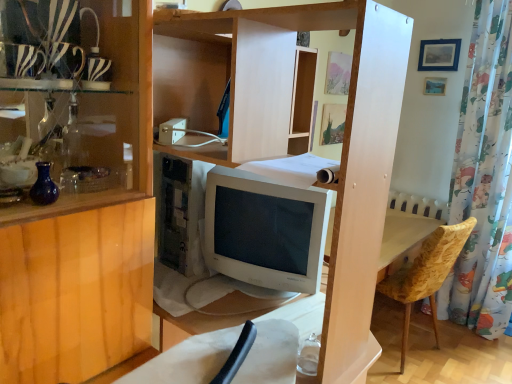
Question: Is zebra-patterned glass at upper left closer to the viewer compared to velvet yellow chair at lower right?

Choices:
 (A) no
 (B) yes

Answer: (B)

Question: Considering the relative sizes of zebra-patterned glass at upper left and velvet yellow chair at lower right in the image provided, is zebra-patterned glass at upper left taller than velvet yellow chair at lower right?

Choices:
 (A) yes
 (B) no

Answer: (B)

Question: Does zebra-patterned glass at upper left appear on the right side of velvet yellow chair at lower right?

Choices:
 (A) yes
 (B) no

Answer: (B)

Question: From the image's perspective, is zebra-patterned glass at upper left on top of velvet yellow chair at lower right?

Choices:
 (A) no
 (B) yes

Answer: (B)

Question: From a real-world perspective, is zebra-patterned glass at upper left physically below velvet yellow chair at lower right?

Choices:
 (A) no
 (B) yes

Answer: (A)

Question: Does zebra-patterned glass at upper left appear on the left side of velvet yellow chair at lower right?

Choices:
 (A) yes
 (B) no

Answer: (A)

Question: Can you confirm if zebra-patterned glass at upper left is wider than blue glass vase at left?

Choices:
 (A) no
 (B) yes

Answer: (B)

Question: Can you confirm if zebra-patterned glass at upper left is taller than blue glass vase at left?

Choices:
 (A) no
 (B) yes

Answer: (B)

Question: Considering the relative positions of zebra-patterned glass at upper left and blue glass vase at left in the image provided, is zebra-patterned glass at upper left behind blue glass vase at left?

Choices:
 (A) no
 (B) yes

Answer: (B)

Question: Considering the relative positions of zebra-patterned glass at upper left and blue glass vase at left in the image provided, is zebra-patterned glass at upper left to the right of blue glass vase at left from the viewer's perspective?

Choices:
 (A) no
 (B) yes

Answer: (A)

Question: From a real-world perspective, is zebra-patterned glass at upper left physically above blue glass vase at left?

Choices:
 (A) yes
 (B) no

Answer: (A)

Question: From the image's perspective, would you say zebra-patterned glass at upper left is shown under blue glass vase at left?

Choices:
 (A) no
 (B) yes

Answer: (A)

Question: Does blue glass vase at left have a greater height compared to blue matte picture frame at upper right?

Choices:
 (A) yes
 (B) no

Answer: (B)